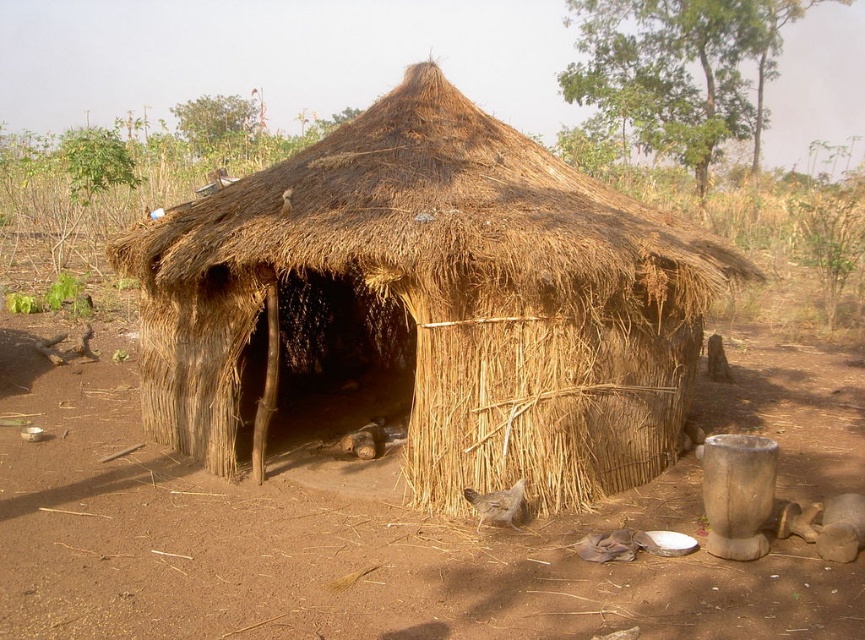
You are standing in front of the traditional round hut and want to know which of the two points, point (213,516) or point (504,518), is closer to you. Can you determine this?

Point (213,516) is further to the camera than point (504,518), so point (504,518) is closer to you.